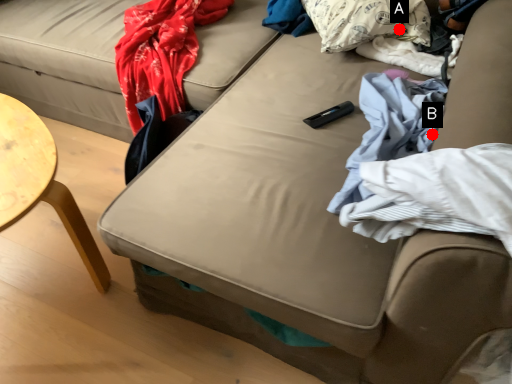
Question: Two points are circled on the image, labeled by A and B beside each circle. Which point is closer to the camera?

Choices:
 (A) A is closer
 (B) B is closer

Answer: (B)